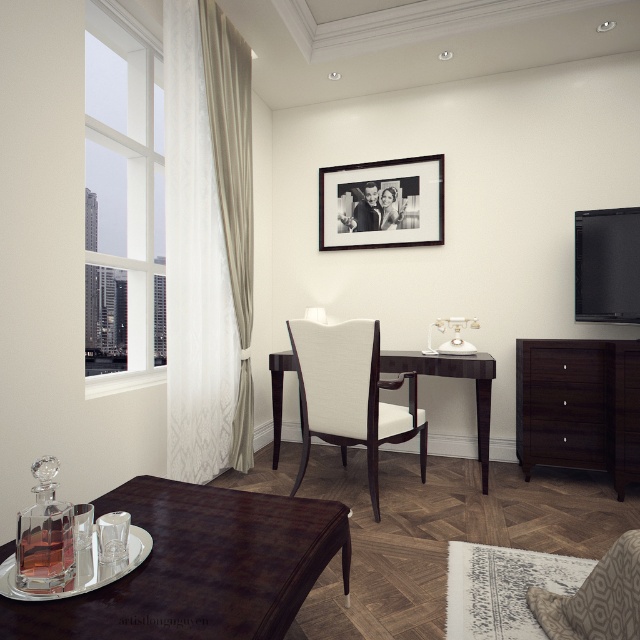
You are a guest in this apartment and want to pour a drink from the glass decanter. You need to move from the beige velvet curtain at left to the dark wood table at center. Which direction should you move towards?

→ You should move towards the right side because the dark wood table at center is on the right side of the beige velvet curtain at left.

You are arranging furniture in the living room and need to place a new sofa between the dark wood dresser at right and the black matte picture frame at upper center. Based on their positions, where should the sofa be placed to ensure it is between both objects?

The dark wood dresser at right is to the right of the black matte picture frame at upper center, so placing the sofa between them would require positioning it to the right of the black matte picture frame at upper center and to the left of the dark wood dresser at right.

You are planning to replace the beige velvet curtain at left and the dark wood table at center with new items. If you want to keep the same proportions as the current items, which object should you choose a larger size for when replacing?

Since the beige velvet curtain at left is smaller than the dark wood table at center, when replacing them, you should choose a larger size for the beige velvet curtain at left to maintain the same proportions.